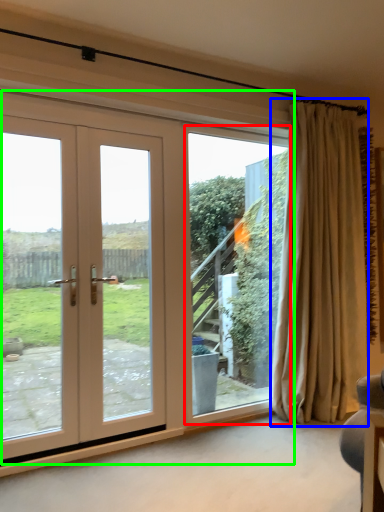
Question: Which object is positioned farthest from window screen (highlighted by a red box)? Select from curtain (highlighted by a blue box) and door (highlighted by a green box).

Choices:
 (A) curtain
 (B) door

Answer: (B)